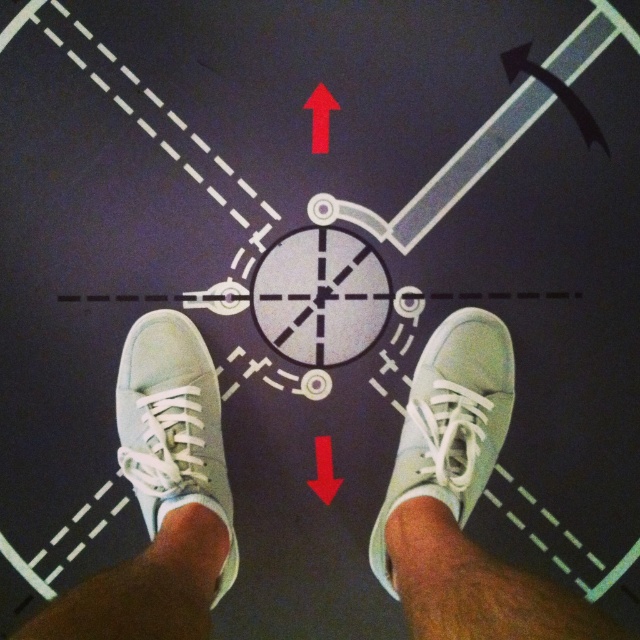
Question: Which point is farther to the camera?

Choices:
 (A) (301, 282)
 (B) (406, 550)
 (C) (134, 378)

Answer: (A)

Question: Considering the real-world distances, which object is farthest from the metallic gray circle at center?

Choices:
 (A) light blue suede shoe at center
 (B) red matte arrow at upper center

Answer: (B)

Question: Estimate the real-world distances between objects in this image. Which object is farther from the red matte arrow at upper center?

Choices:
 (A) suede-like skin at lower center
 (B) light blue suede shoe at center
 (C) metallic gray circle at center

Answer: (A)

Question: Is white canvas shoes at center to the left of light blue suede shoe at center from the viewer's perspective?

Choices:
 (A) yes
 (B) no

Answer: (B)

Question: Does white canvas shoes at center come in front of light skin at center?

Choices:
 (A) yes
 (B) no

Answer: (A)

Question: Does light blue suede shoe at center appear under suede-like skin at lower center?

Choices:
 (A) no
 (B) yes

Answer: (A)